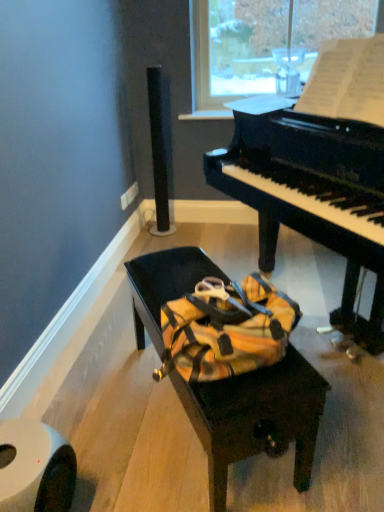
Question: Does matte black bench at center turn towards black glossy piano at center?

Choices:
 (A) yes
 (B) no

Answer: (A)

Question: Can you confirm if matte black bench at center is smaller than black glossy piano at center?

Choices:
 (A) no
 (B) yes

Answer: (B)

Question: Does matte black bench at center lie in front of black glossy piano at center?

Choices:
 (A) no
 (B) yes

Answer: (A)

Question: Is black glossy piano at center completely or partially inside matte black bench at center?

Choices:
 (A) no
 (B) yes

Answer: (A)

Question: From a real-world perspective, does matte black bench at center stand above black glossy piano at center?

Choices:
 (A) yes
 (B) no

Answer: (B)

Question: Is matte black bench at center far from black glossy piano at center?

Choices:
 (A) no
 (B) yes

Answer: (A)

Question: Does matte black bench at center appear on the right side of white matte toilet paper at lower left?

Choices:
 (A) no
 (B) yes

Answer: (B)

Question: Is matte black bench at center in contact with white matte toilet paper at lower left?

Choices:
 (A) no
 (B) yes

Answer: (A)

Question: Is matte black bench at center turned away from white matte toilet paper at lower left?

Choices:
 (A) no
 (B) yes

Answer: (B)

Question: Are matte black bench at center and white matte toilet paper at lower left far apart?

Choices:
 (A) yes
 (B) no

Answer: (B)

Question: Does matte black bench at center have a smaller size compared to white matte toilet paper at lower left?

Choices:
 (A) yes
 (B) no

Answer: (B)

Question: Could white matte toilet paper at lower left be considered to be inside matte black bench at center?

Choices:
 (A) yes
 (B) no

Answer: (B)

Question: From the image's perspective, is white matte toilet paper at lower left located beneath matte black bench at center?

Choices:
 (A) no
 (B) yes

Answer: (B)